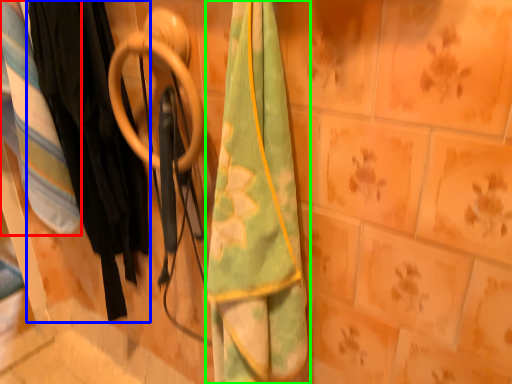
Question: Estimate the real-world distances between objects in this image. Which object is farther from blanket (highlighted by a red box), clothing (highlighted by a blue box) or towel (highlighted by a green box)?

Choices:
 (A) clothing
 (B) towel

Answer: (B)